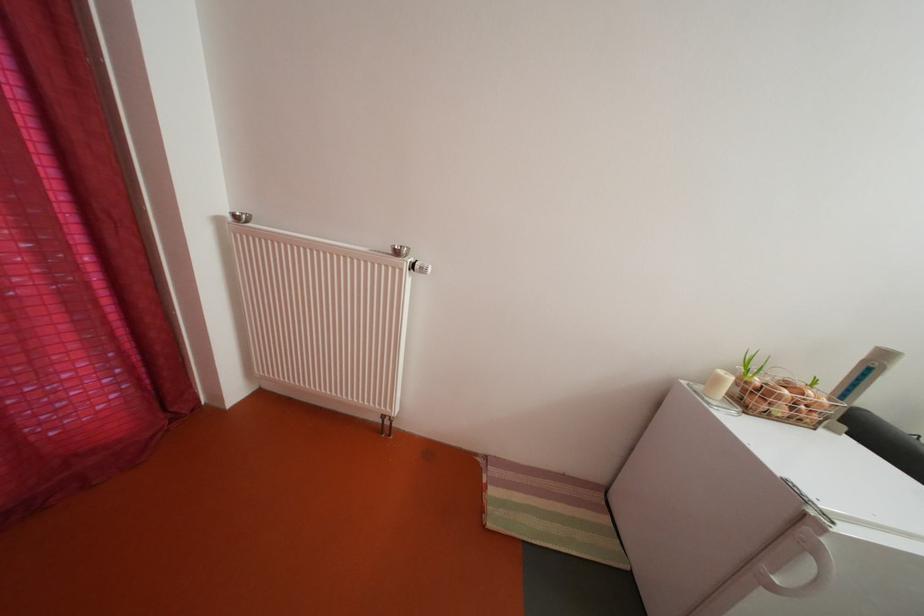
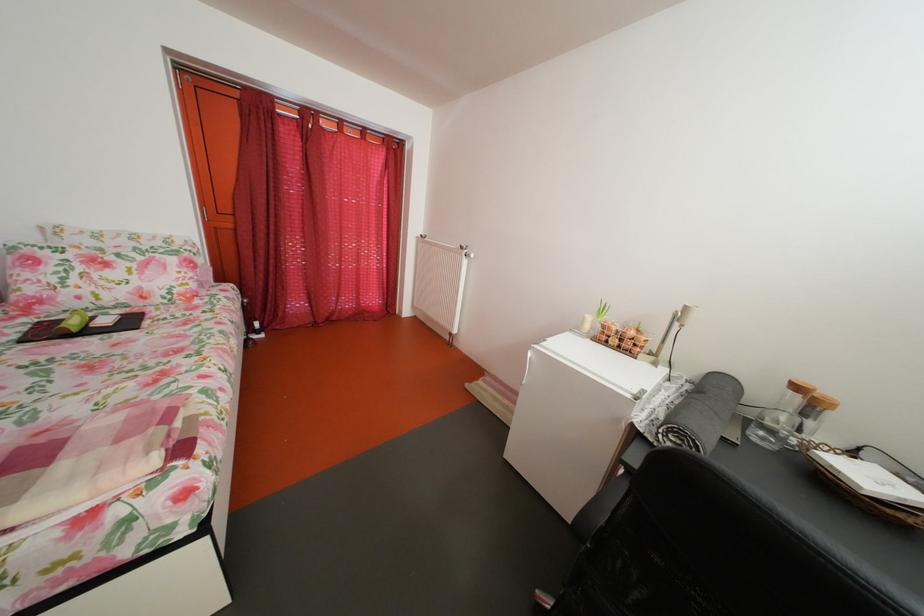
In the second image, find the point that corresponds to (x=407, y=259) in the first image.

(473, 254)